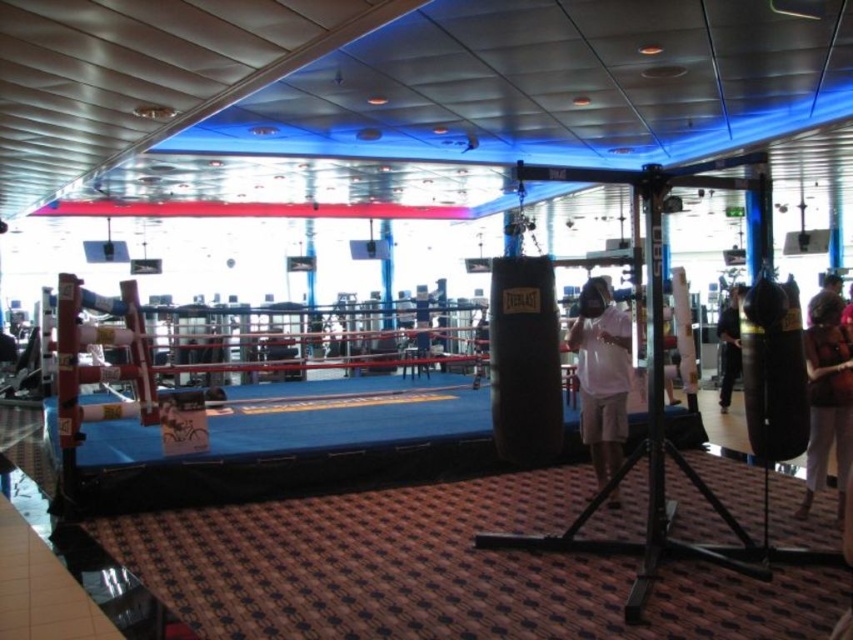
Question: Is white matte shirt at center to the right of dark brown leather jacket at lower right from the viewer's perspective?

Choices:
 (A) yes
 (B) no

Answer: (B)

Question: Is white matte shirt at center positioned behind dark brown leather jacket at lower right?

Choices:
 (A) no
 (B) yes

Answer: (B)

Question: Considering the relative positions of dark brown leather jacket at lower right and brown leather jacket at upper right in the image provided, where is dark brown leather jacket at lower right located with respect to brown leather jacket at upper right?

Choices:
 (A) right
 (B) left

Answer: (B)

Question: Which point appears farthest from the camera in this image?

Choices:
 (A) (728, 330)
 (B) (828, 348)
 (C) (589, 282)

Answer: (A)

Question: Which point is farther to the camera?

Choices:
 (A) black fabric pants at lower right
 (B) dark brown leather jacket at lower right
 (C) brown leather jacket at upper right
 (D) white matte shirt at center

Answer: (A)

Question: Which point appears farthest from the camera in this image?

Choices:
 (A) (808, 321)
 (B) (616, 497)

Answer: (B)